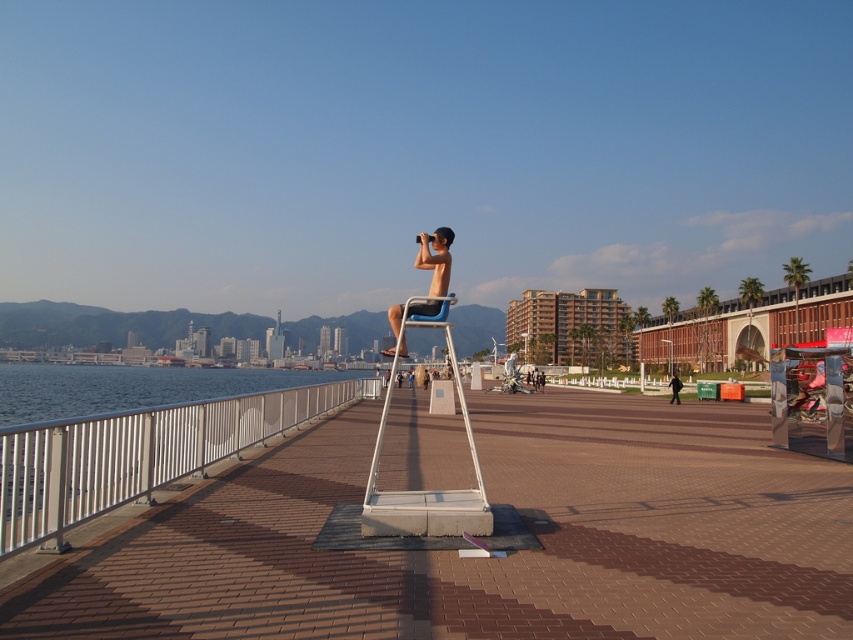
You are standing on the paved walkway and want to reach the water. There is a white concrete dock at center and a white plastic ladder at center. Which object should you approach first to get closer to the water?

The white plastic ladder at center is to the left of the white concrete dock at center, so you should approach the white plastic ladder at center first to get closer to the water.